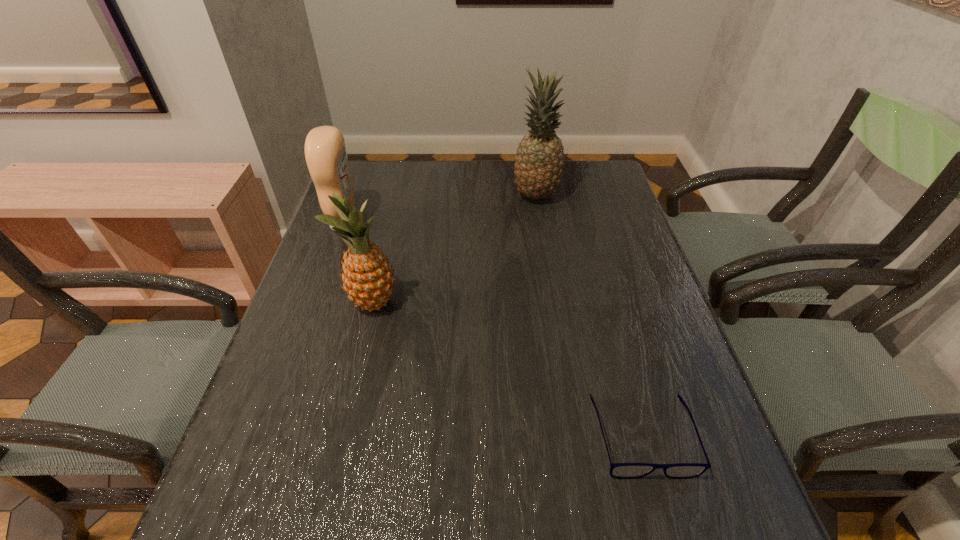
You are a GUI agent. You are given a task and a screenshot of the screen. Output one action in this format:
    pyautogui.click(x=<x>, y=<y>)
    Task: Click on the free space between the condiment and the right pineapple
    Image resolution: width=960 pixels, height=540 pixels.
    Given the screenshot: What is the action you would take?
    pyautogui.click(x=441, y=210)

Find the location of a particular element. The width and height of the screenshot is (960, 540). free space between the right pineapple and the third object from right to left is located at coordinates (455, 249).

Locate an element on the screen. vacant space in between the spectacles and the right pineapple is located at coordinates (589, 316).

Identify the location of vacant point located between the farther pineapple and the leftmost object. (441, 210).

You are a GUI agent. You are given a task and a screenshot of the screen. Output one action in this format:
    pyautogui.click(x=<x>, y=<y>)
    Task: Click on the blank region between the spectacles and the right pineapple
    This screenshot has width=960, height=540.
    Given the screenshot: What is the action you would take?
    pyautogui.click(x=589, y=316)

Image resolution: width=960 pixels, height=540 pixels. I want to click on free space between the second object from left to right and the farther pineapple, so click(x=455, y=249).

Identify the location of vacant region between the nearer pineapple and the spectacles. (509, 369).

You are a GUI agent. You are given a task and a screenshot of the screen. Output one action in this format:
    pyautogui.click(x=<x>, y=<y>)
    Task: Click on the free area in between the right pineapple and the leftmost object
    The height and width of the screenshot is (540, 960).
    Given the screenshot: What is the action you would take?
    pyautogui.click(x=441, y=210)

Find the location of `empty space that is in between the shortest object and the right pineapple`. empty space that is in between the shortest object and the right pineapple is located at coordinates (589, 316).

Find the location of a particular element. Image resolution: width=960 pixels, height=540 pixels. object that is the third closest to the leftmost object is located at coordinates [617, 470].